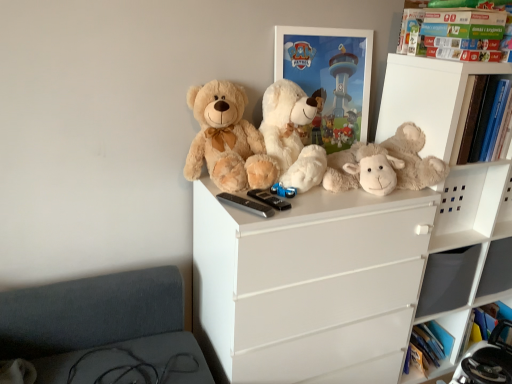
Locate an element on the screen. This screenshot has height=384, width=512. empty space that is ontop of white glossy picture frame at upper center (from a real-world perspective) is located at coordinates (332, 22).